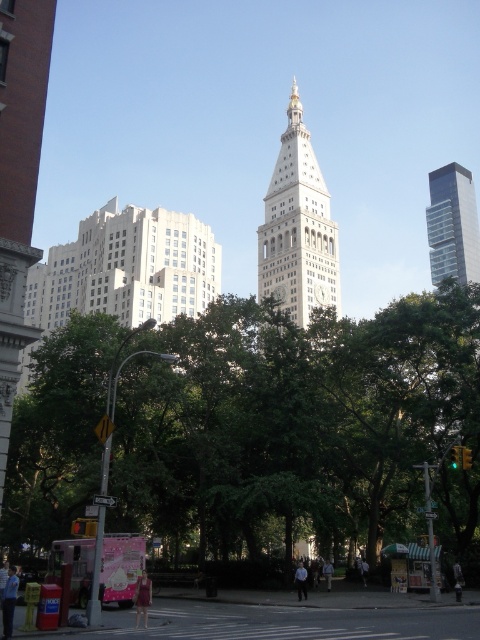
Question: Is green leafy tree at center below red glass traffic light at lower left?

Choices:
 (A) no
 (B) yes

Answer: (A)

Question: Does green leafy tree at center have a smaller size compared to white stone clock tower at center?

Choices:
 (A) no
 (B) yes

Answer: (A)

Question: Is glassy reflective skyscraper at upper right positioned before green glass traffic light at center?

Choices:
 (A) yes
 (B) no

Answer: (B)

Question: Which object appears farthest from the camera in this image?

Choices:
 (A) green glass traffic light at right
 (B) glassy reflective skyscraper at upper right

Answer: (B)

Question: Which point is farther to the camera?

Choices:
 (A) glassy reflective skyscraper at upper right
 (B) green glass traffic light at center
 (C) green leafy tree at center

Answer: (A)

Question: Which of these objects is positioned farthest from the green leafy tree at center?

Choices:
 (A) green glass traffic light at center
 (B) white stone clock tower at center
 (C) glassy reflective skyscraper at upper right

Answer: (C)